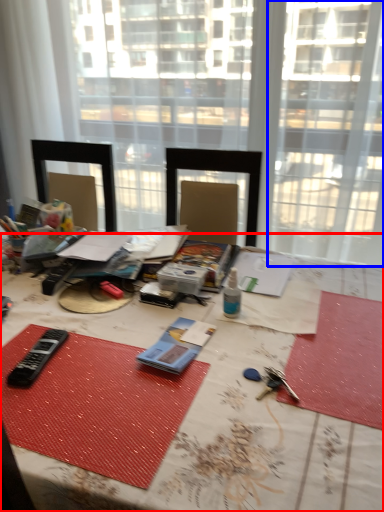
Question: Which of the following is the farthest to the observer, table (highlighted by a red box) or window (highlighted by a blue box)?

Choices:
 (A) table
 (B) window

Answer: (B)